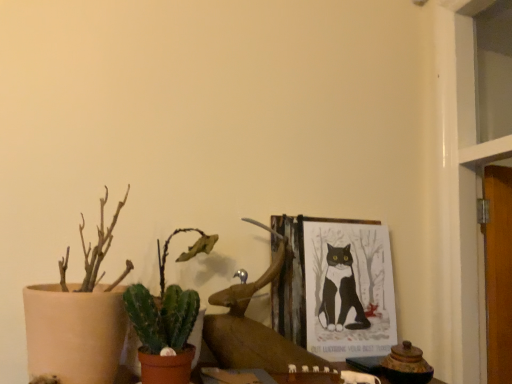
Question: Is wooden picture frame at upper center shorter than matte beige pot at left, the first houseplant from the left?

Choices:
 (A) yes
 (B) no

Answer: (A)

Question: Considering the relative sizes of wooden picture frame at upper center and matte beige pot at left, the second houseplant from the right, in the image provided, is wooden picture frame at upper center thinner than matte beige pot at left, the second houseplant from the right,?

Choices:
 (A) yes
 (B) no

Answer: (A)

Question: Is wooden picture frame at upper center further to the viewer compared to matte beige pot at left, the first houseplant from the left?

Choices:
 (A) yes
 (B) no

Answer: (A)

Question: Can we say wooden picture frame at upper center lies outside matte beige pot at left, the second houseplant from the right?

Choices:
 (A) no
 (B) yes

Answer: (B)

Question: Would you say matte beige pot at left, the first houseplant from the left, is part of wooden picture frame at upper center's contents?

Choices:
 (A) no
 (B) yes

Answer: (A)

Question: In terms of size, does green matte cactus at lower left, the 2th houseplant positioned from the left, appear bigger or smaller than wooden picture frame at upper center?

Choices:
 (A) small
 (B) big

Answer: (B)

Question: From their relative heights in the image, would you say green matte cactus at lower left, the 2th houseplant positioned from the left, is taller or shorter than wooden picture frame at upper center?

Choices:
 (A) short
 (B) tall

Answer: (A)

Question: Considering the relative positions of green matte cactus at lower left, the 2th houseplant positioned from the left, and wooden picture frame at upper center in the image provided, is green matte cactus at lower left, the 2th houseplant positioned from the left, to the left or to the right of wooden picture frame at upper center?

Choices:
 (A) left
 (B) right

Answer: (A)

Question: Which is correct: green matte cactus at lower left, marked as the first houseplant in a right-to-left arrangement, is inside wooden picture frame at upper center, or outside of it?

Choices:
 (A) inside
 (B) outside

Answer: (B)

Question: Is wooden picture frame at upper center situated inside green matte cactus at lower left, the 2th houseplant positioned from the left, or outside?

Choices:
 (A) outside
 (B) inside

Answer: (A)

Question: From a real-world perspective, is wooden picture frame at upper center physically located above or below green matte cactus at lower left, the 2th houseplant positioned from the left?

Choices:
 (A) below
 (B) above

Answer: (B)

Question: Looking at the image, does wooden picture frame at upper center seem bigger or smaller compared to green matte cactus at lower left, marked as the first houseplant in a right-to-left arrangement?

Choices:
 (A) small
 (B) big

Answer: (A)

Question: From the image's perspective, relative to green matte cactus at lower left, marked as the first houseplant in a right-to-left arrangement, is wooden picture frame at upper center above or below?

Choices:
 (A) below
 (B) above

Answer: (A)

Question: From the image's perspective, is green succulent at lower left above or below green matte cactus at lower left, the 2th houseplant positioned from the left?

Choices:
 (A) above
 (B) below

Answer: (B)

Question: Considering the positions of point (153, 316) and point (175, 326), is point (153, 316) closer or farther from the camera than point (175, 326)?

Choices:
 (A) closer
 (B) farther

Answer: (A)